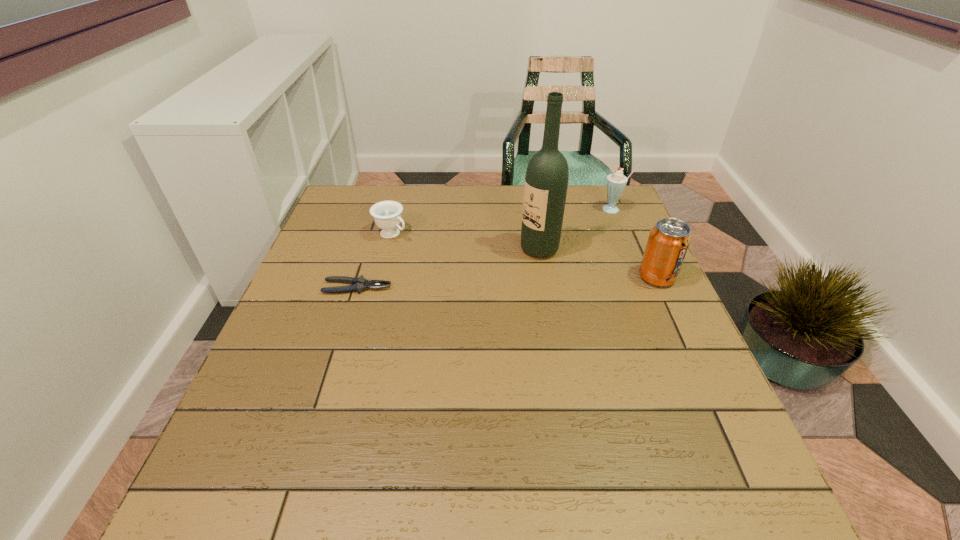
Find the location of a particular element. teacup that is at the left edge is located at coordinates (387, 214).

At what (x,y) coordinates should I click in order to perform the action: click on soda can located at the right edge. Please return your answer as a coordinate pair (x, y). The height and width of the screenshot is (540, 960). Looking at the image, I should click on (668, 241).

The width and height of the screenshot is (960, 540). Identify the location of milkshake present at the right edge. (615, 183).

Locate an element on the screen. The image size is (960, 540). object present at the far left corner is located at coordinates (387, 214).

Where is `object at the far right corner`? The width and height of the screenshot is (960, 540). object at the far right corner is located at coordinates (615, 183).

At what (x,y) coordinates should I click in order to perform the action: click on vacant space at the far edge of the desktop. Please return your answer as a coordinate pair (x, y). Looking at the image, I should click on (493, 216).

You are a GUI agent. You are given a task and a screenshot of the screen. Output one action in this format:
    pyautogui.click(x=<x>, y=<y>)
    Task: Click on the free space at the near edge
    
    Given the screenshot: What is the action you would take?
    pyautogui.click(x=318, y=447)

Find the location of a particular element. free spot at the left edge of the desktop is located at coordinates (326, 374).

This screenshot has height=540, width=960. In order to click on blank area at the right edge in this screenshot , I will do `click(586, 234)`.

Image resolution: width=960 pixels, height=540 pixels. Identify the location of vacant space at the far left corner of the desktop. (355, 190).